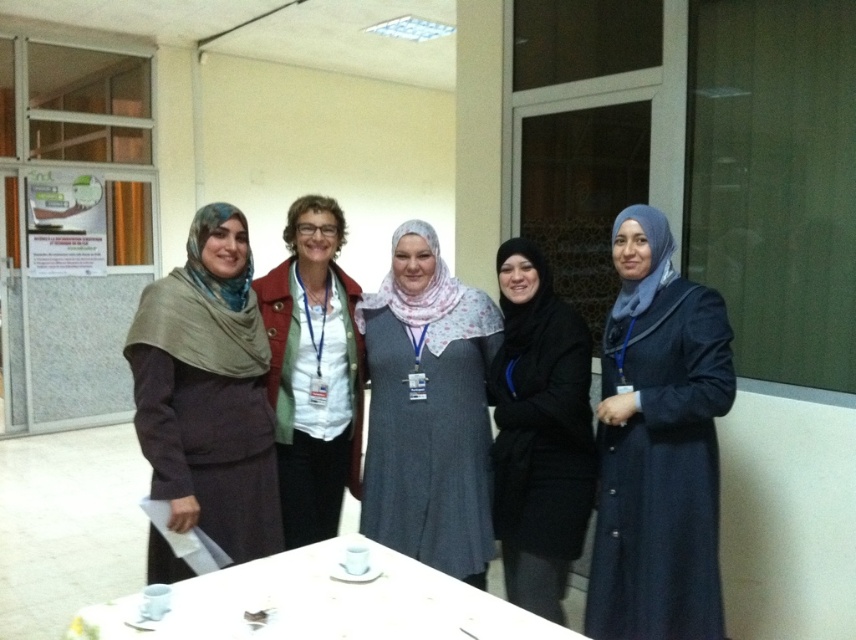
Question: From the image, what is the correct spatial relationship of matte brown scarf at center in relation to white glossy table at lower center?

Choices:
 (A) left
 (B) right

Answer: (A)

Question: Considering the relative positions of blue matte hijab at center and matte brown scarf at center in the image provided, where is blue matte hijab at center located with respect to matte brown scarf at center?

Choices:
 (A) left
 (B) right

Answer: (B)

Question: Is white glossy table at lower center to the left of white fabric coat at center from the viewer's perspective?

Choices:
 (A) no
 (B) yes

Answer: (A)

Question: Which point is closer to the camera?

Choices:
 (A) gray fabric dress at center
 (B) matte brown scarf at center
 (C) white fabric coat at center
 (D) black matte hijab at center

Answer: (B)

Question: Among these objects, which one is farthest from the camera?

Choices:
 (A) matte brown scarf at center
 (B) gray fabric dress at center

Answer: (B)

Question: Estimate the real-world distances between objects in this image. Which object is closer to the blue matte hijab at center?

Choices:
 (A) gray fabric dress at center
 (B) white fabric coat at center
 (C) matte brown scarf at center

Answer: (A)